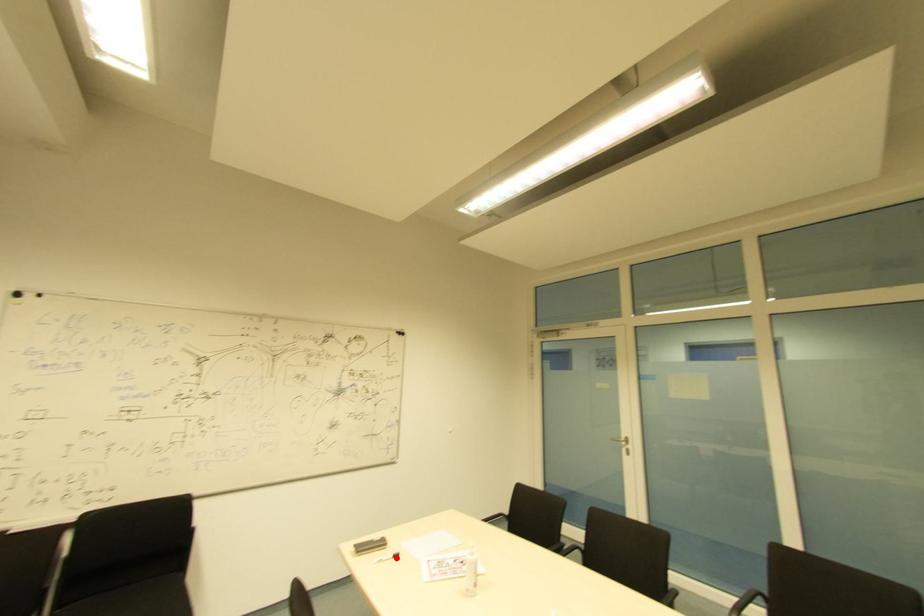
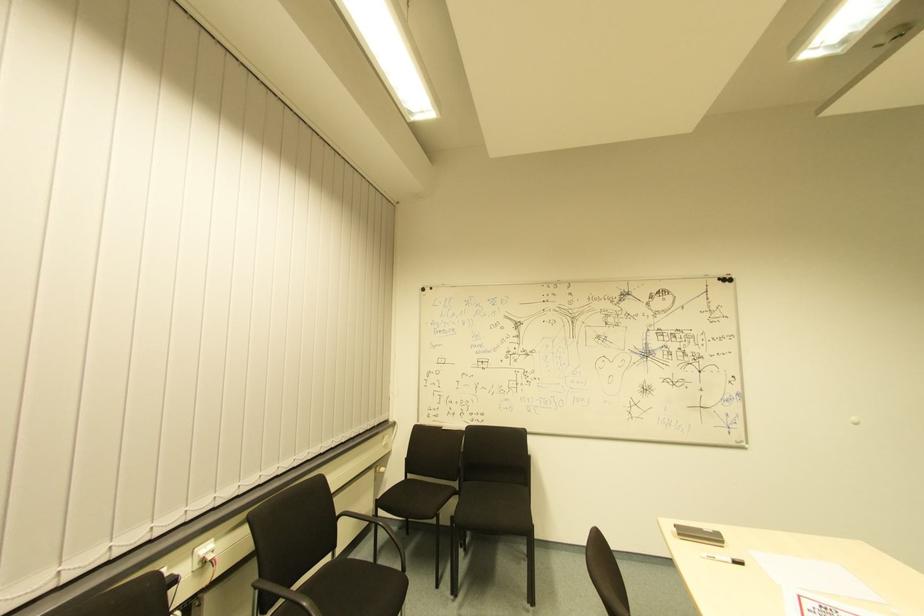
The point at the highlighted location is marked in the first image. Where is the corresponding point in the second image?

(737, 565)